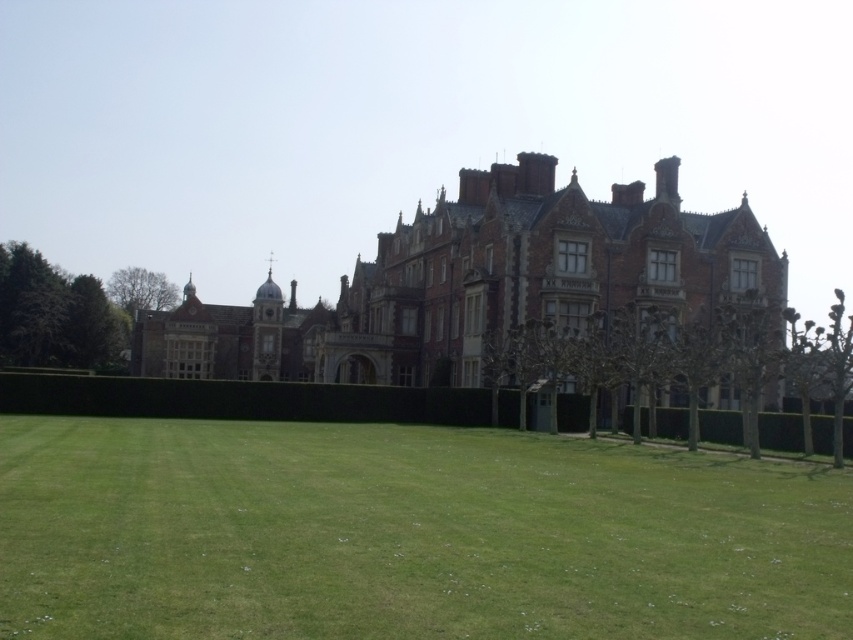
Question: Does green grass at lower center have a greater width compared to brown brick mansion at center?

Choices:
 (A) yes
 (B) no

Answer: (B)

Question: Which of the following is the farthest from the observer?

Choices:
 (A) (573, 253)
 (B) (114, 496)

Answer: (A)

Question: Can you confirm if green grass at lower center is positioned above brown brick mansion at center?

Choices:
 (A) yes
 (B) no

Answer: (B)

Question: Does green grass at lower center appear under brown brick mansion at center?

Choices:
 (A) no
 (B) yes

Answer: (B)